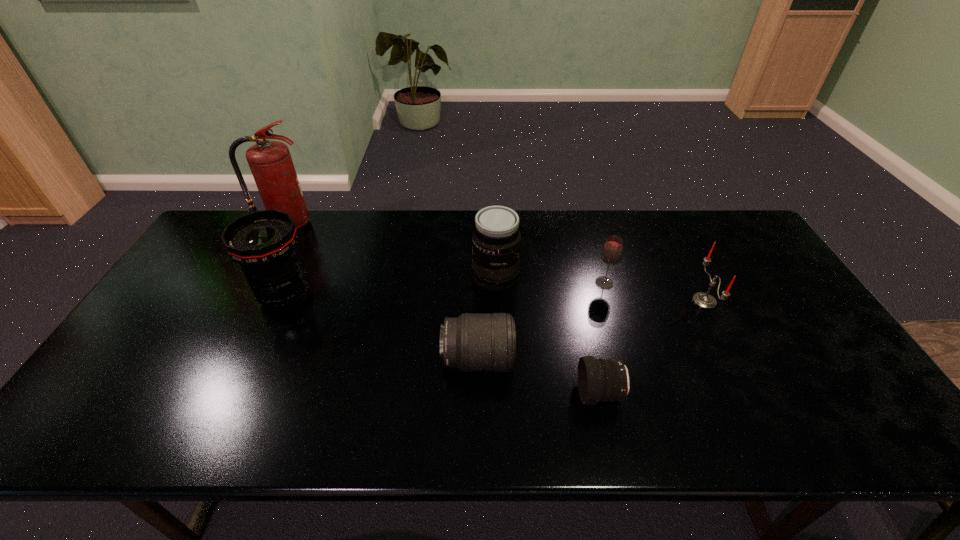
At what (x,y) coordinates should I click in order to perform the action: click on free space located on the front-facing side of the rightmost object. Please return your answer as a coordinate pair (x, y). This screenshot has height=540, width=960. Looking at the image, I should click on (637, 301).

Image resolution: width=960 pixels, height=540 pixels. Find the location of `vacant space located on the front-facing side of the rightmost object`. vacant space located on the front-facing side of the rightmost object is located at coordinates (648, 301).

This screenshot has height=540, width=960. Identify the location of vacant space located on the front-facing side of the rightmost object. (655, 301).

Where is `vacant space situated 0.300m on the back of the glass drink container`? Image resolution: width=960 pixels, height=540 pixels. vacant space situated 0.300m on the back of the glass drink container is located at coordinates (586, 219).

You are a GUI agent. You are given a task and a screenshot of the screen. Output one action in this format:
    pyautogui.click(x=<x>, y=<y>)
    Task: Click on the free space located on the surface of the third tallest telephoto lens
    
    Given the screenshot: What is the action you would take?
    pyautogui.click(x=544, y=360)

Identify the location of blank area located 0.210m at the front element of the rightmost telephoto lens. This screenshot has width=960, height=540. (490, 394).

At what (x,y) coordinates should I click in order to perform the action: click on free space located at the front element of the rightmost telephoto lens. Please return your answer as a coordinate pair (x, y). This screenshot has height=540, width=960. Looking at the image, I should click on (553, 394).

Find the location of `free space located 0.250m at the front element of the rightmost telephoto lens`. free space located 0.250m at the front element of the rightmost telephoto lens is located at coordinates (473, 394).

At what (x,y) coordinates should I click in order to perform the action: click on object located in the far edge section of the desktop. Please return your answer as a coordinate pair (x, y). This screenshot has height=540, width=960. Looking at the image, I should click on (270, 162).

The height and width of the screenshot is (540, 960). I want to click on object that is positioned at the near edge, so click(x=603, y=380).